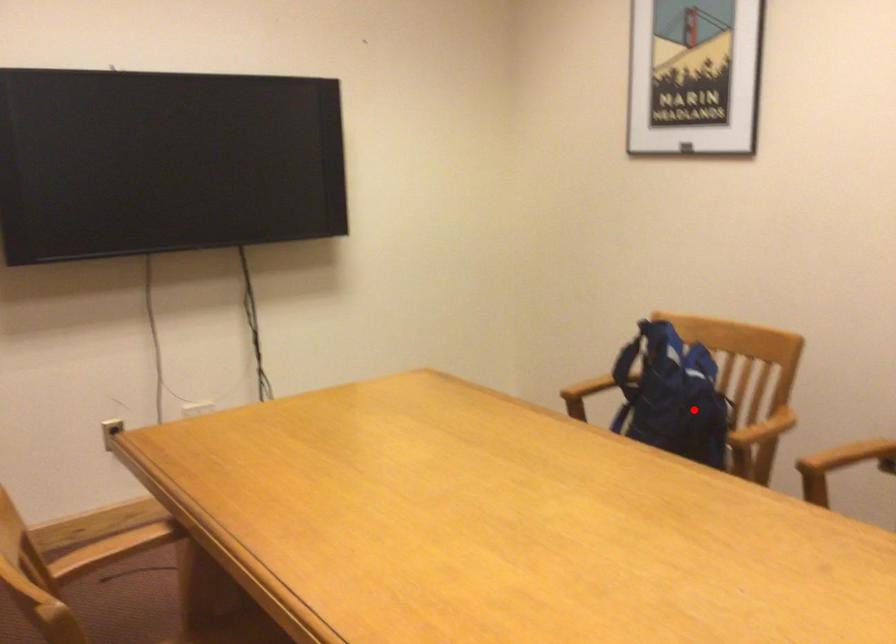
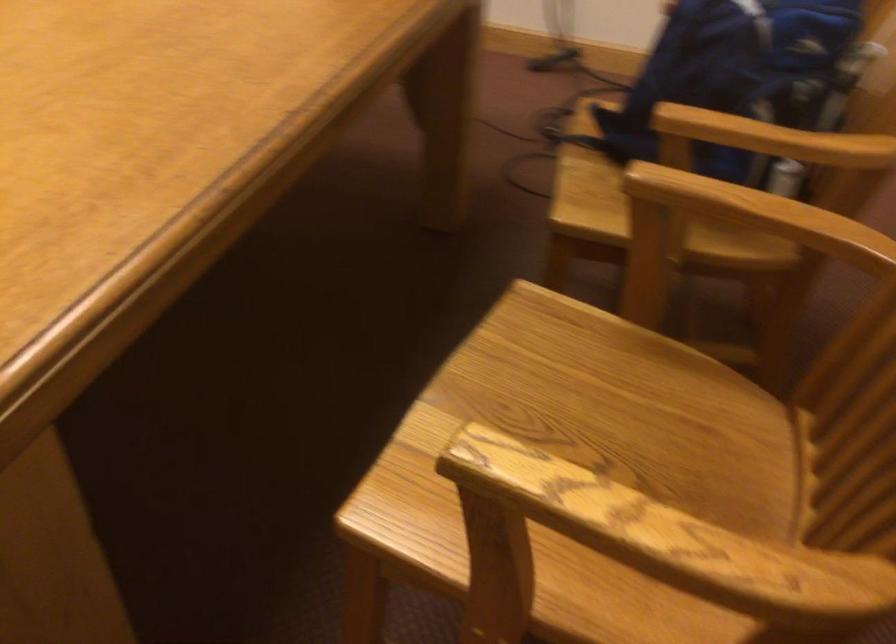
In the second image, find the point that corresponds to the highlighted location in the first image.

(736, 73)